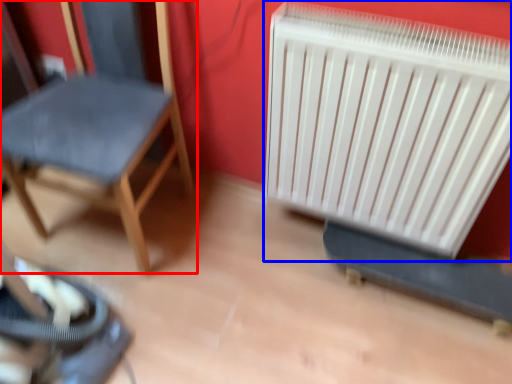
Question: Among these objects, which one is nearest to the camera, chair (highlighted by a red box) or radiator (highlighted by a blue box)?

Choices:
 (A) chair
 (B) radiator

Answer: (A)